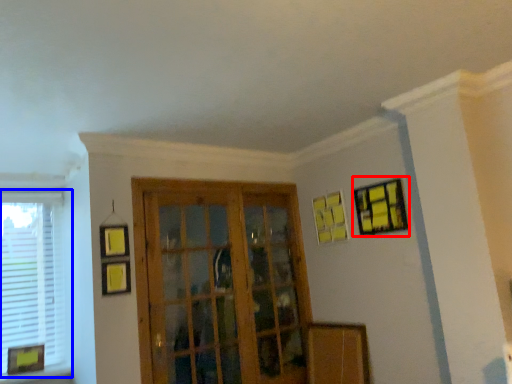
Question: Which object is further to the camera taking this photo, picture frame (highlighted by a red box) or window (highlighted by a blue box)?

Choices:
 (A) picture frame
 (B) window

Answer: (B)